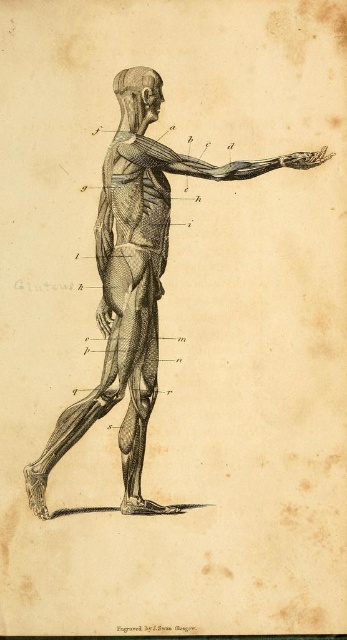
You are a medical student examining the anatomical illustration of the human muscular system. You notice two points labeled in the image. The first point is at coordinate point (303, 163) and the second is at point (134, 109). Which of these two points is positioned closer to your viewpoint as you look at the illustration?

Point (303, 163) is closer to the viewer than point (134, 109) according to the illustration.

Based on the anatomical illustration of the muscular system, which object is located below the other between the matte black arm at upper center and the smooth gray skull at upper center?

The matte black arm at upper center is positioned under the smooth gray skull at upper center, so the arm is below the skull.

You are a photographer standing at a point in front of the anatomical illustration. You want to capture a clear photo of the point labeled as point (97, 413). What is the minimum distance you need to maintain from the illustration to ensure the point is in focus?

The minimum distance you need to maintain from the illustration to ensure the point labeled as point (97, 413) is in focus is 66.37 meters, as this is the distance of the point from the camera.